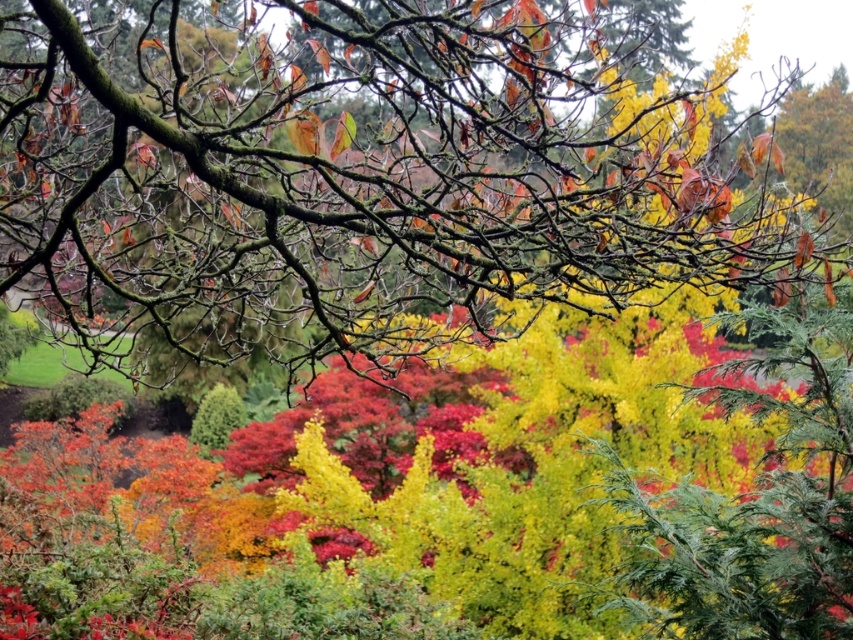
Based on the scene description, what can be found at the coordinates point (363, 173)?

At point (363, 173) lies smooth bark tree at center.

You are an artist wanting to paint the scene. You have two brushes, one for the smooth bark tree at center and one for the green matte bush at center. Which brush should you choose if you want to use a thinner brush for the tree?

The smooth bark tree at center is thinner than the green matte bush at center, so you should choose the thinner brush for the smooth bark tree at center.